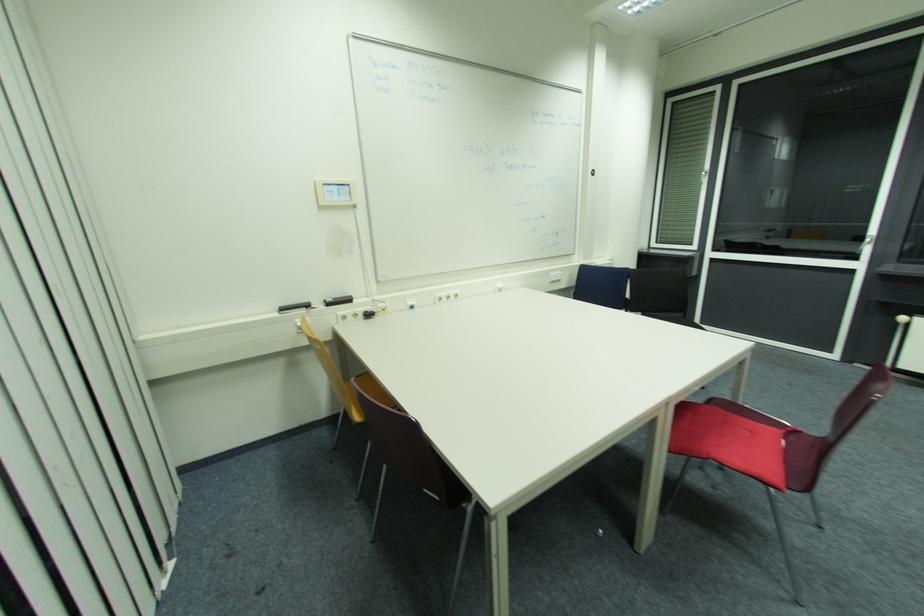
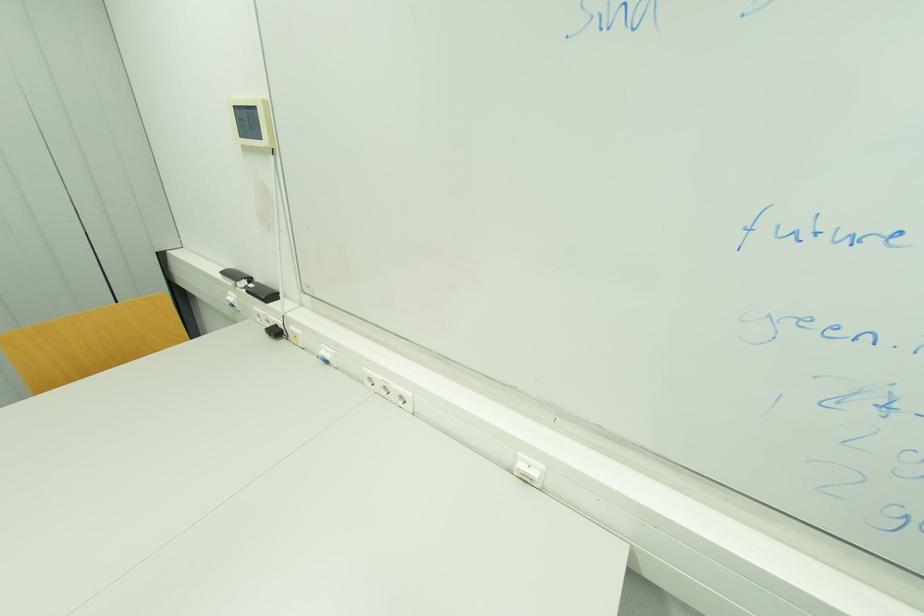
Find the pixel in the second image that matches (x=416, y=309) in the first image.

(330, 362)